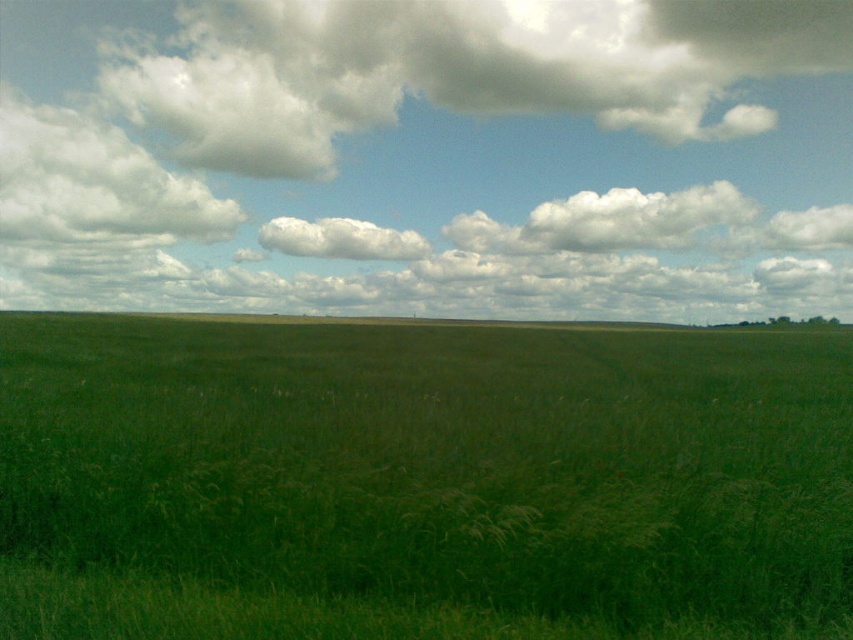
Can you confirm if green grass at lower center is smaller than white fluffy cloud at center?

No.

Is green grass at lower center thinner than white fluffy cloud at center?

No.

Does point (386, 45) come behind point (410, 237)?

Yes, it is behind point (410, 237).

Identify the location of green grass at lower center. (430, 154).

Can you confirm if green grassy pasture at center is taller than white fluffy cloud at center?

No.

Does green grassy pasture at center appear on the right side of white fluffy cloud at center?

Correct, you'll find green grassy pasture at center to the right of white fluffy cloud at center.

This screenshot has height=640, width=853. Describe the element at coordinates (421, 481) in the screenshot. I see `green grassy pasture at center` at that location.

In order to click on green grassy pasture at center in this screenshot , I will do [421, 481].

How much distance is there between green grassy pasture at center and white fluffy cloud at upper left?

green grassy pasture at center and white fluffy cloud at upper left are 316.17 feet apart from each other.

Can you confirm if green grassy pasture at center is wider than white fluffy cloud at upper left?

Yes.

Between point (555, 497) and point (173, 182), which one is positioned in front?

Positioned in front is point (555, 497).

Identify the location of green grassy pasture at center. The width and height of the screenshot is (853, 640). (421, 481).